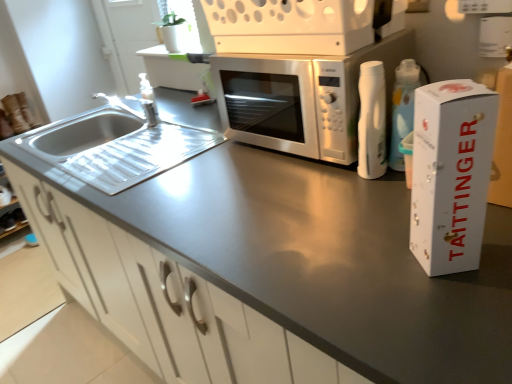
Where is `vacant space in front of satin silver microwave at center`? This screenshot has width=512, height=384. vacant space in front of satin silver microwave at center is located at coordinates (301, 200).